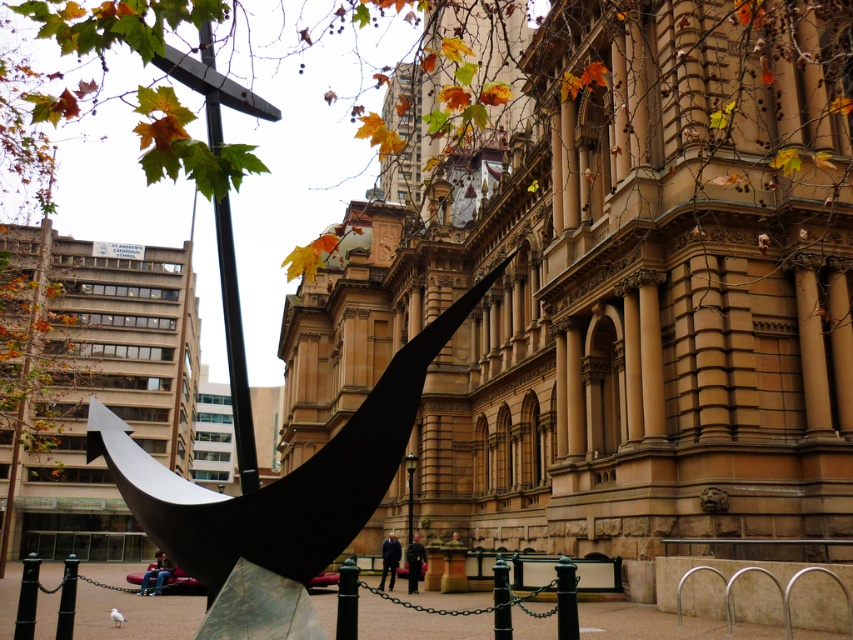
Between polished black sculpture at center and black polished pole at center, which one has more height?

black polished pole at center

The height and width of the screenshot is (640, 853). Describe the element at coordinates (279, 499) in the screenshot. I see `polished black sculpture at center` at that location.

Describe the element at coordinates (279, 499) in the screenshot. I see `polished black sculpture at center` at that location.

Locate an element on the screen. The height and width of the screenshot is (640, 853). polished black sculpture at center is located at coordinates (279, 499).

Is point (244, 412) farther from camera compared to point (416, 588)?

No.

Which is behind, point (207, 90) or point (416, 584)?

Point (416, 584)

At what (x,y) coordinates should I click in order to perform the action: click on black polished pole at center. Please return your answer as a coordinate pair (x, y). Image resolution: width=853 pixels, height=640 pixels. Looking at the image, I should click on (235, 349).

Which is more to the left, polished black sculpture at center or metallic pole at upper center?

From the viewer's perspective, metallic pole at upper center appears more on the left side.

Does polished black sculpture at center appear under metallic pole at upper center?

Indeed, polished black sculpture at center is positioned under metallic pole at upper center.

Who is more forward, (286, 513) or (196, 80)?

Point (286, 513)

Where is `polished black sculpture at center`? polished black sculpture at center is located at coordinates (279, 499).